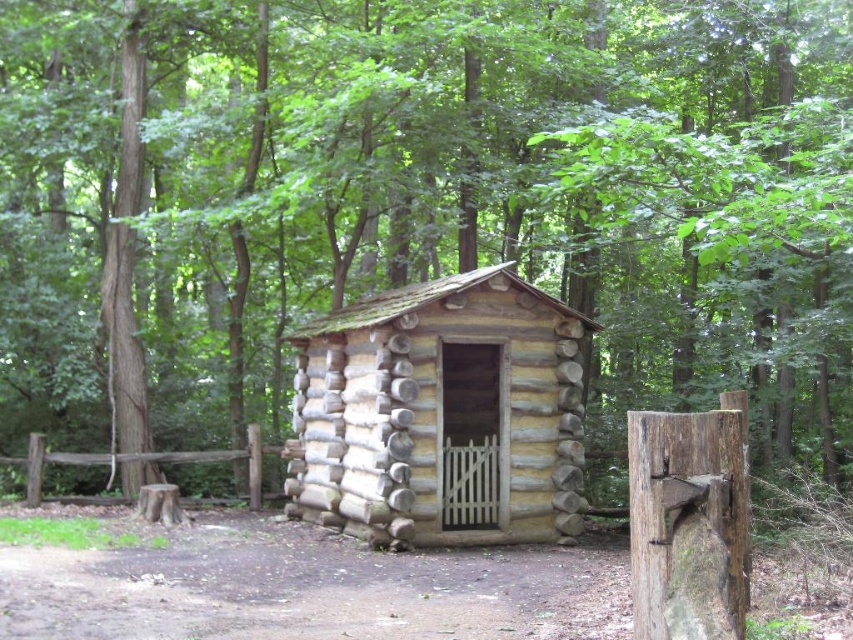
At what (x,y) coordinates should I click in order to perform the action: click on smooth brown log at center. Please return your answer as a coordinate pair (x, y). This screenshot has height=640, width=853. Looking at the image, I should click on (688, 522).

Does point (668, 554) lie behind point (33, 474)?

No.

The width and height of the screenshot is (853, 640). I want to click on smooth brown log at center, so click(688, 522).

Does light brown wooden log cabin at center appear on the right side of brown wooden fence at lower left?

Yes, light brown wooden log cabin at center is to the right of brown wooden fence at lower left.

Does light brown wooden log cabin at center lie in front of brown wooden fence at lower left?

Yes, it is.

I want to click on light brown wooden log cabin at center, so click(x=442, y=413).

This screenshot has width=853, height=640. Describe the element at coordinates (442, 413) in the screenshot. I see `light brown wooden log cabin at center` at that location.

Is light brown wooden log cabin at center smaller than smooth brown log at center?

No.

Is point (386, 515) closer to viewer compared to point (722, 452)?

No.

Locate an element on the screen. This screenshot has width=853, height=640. light brown wooden log cabin at center is located at coordinates (442, 413).